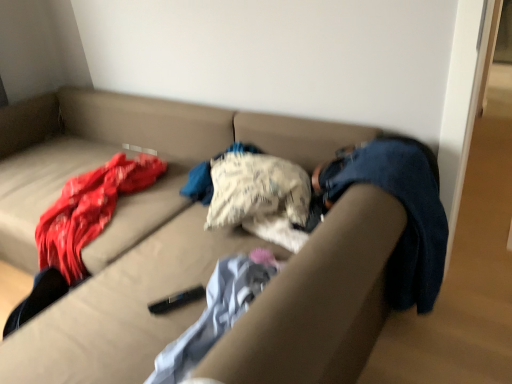
Question: Could you tell me if beige fabric couch at center is turned towards light blue textured blanket at center?

Choices:
 (A) no
 (B) yes

Answer: (B)

Question: From the image's perspective, is beige fabric couch at center below light blue textured blanket at center?

Choices:
 (A) yes
 (B) no

Answer: (B)

Question: From the image's perspective, would you say beige fabric couch at center is positioned over light blue textured blanket at center?

Choices:
 (A) yes
 (B) no

Answer: (A)

Question: Would you say light blue textured blanket at center is part of beige fabric couch at center's contents?

Choices:
 (A) yes
 (B) no

Answer: (A)

Question: Considering the relative sizes of beige fabric couch at center and light blue textured blanket at center in the image provided, is beige fabric couch at center taller than light blue textured blanket at center?

Choices:
 (A) no
 (B) yes

Answer: (B)

Question: Is beige fabric couch at center positioned with its back to light blue textured blanket at center?

Choices:
 (A) no
 (B) yes

Answer: (A)

Question: Can beige fabric couch at center be found inside light blue textured blanket at center?

Choices:
 (A) yes
 (B) no

Answer: (B)

Question: Is light blue textured blanket at center next to beige fabric couch at center?

Choices:
 (A) no
 (B) yes

Answer: (A)

Question: Considering the relative sizes of light blue textured blanket at center and beige fabric couch at center in the image provided, is light blue textured blanket at center wider than beige fabric couch at center?

Choices:
 (A) yes
 (B) no

Answer: (B)

Question: Is light blue textured blanket at center bigger than beige fabric couch at center?

Choices:
 (A) yes
 (B) no

Answer: (B)

Question: Are light blue textured blanket at center and beige fabric couch at center located far from each other?

Choices:
 (A) no
 (B) yes

Answer: (A)

Question: From the image's perspective, is light blue textured blanket at center located above beige fabric couch at center?

Choices:
 (A) no
 (B) yes

Answer: (A)

Question: In terms of size, does light blue textured blanket at center appear bigger or smaller than beige fabric couch at center?

Choices:
 (A) small
 (B) big

Answer: (A)